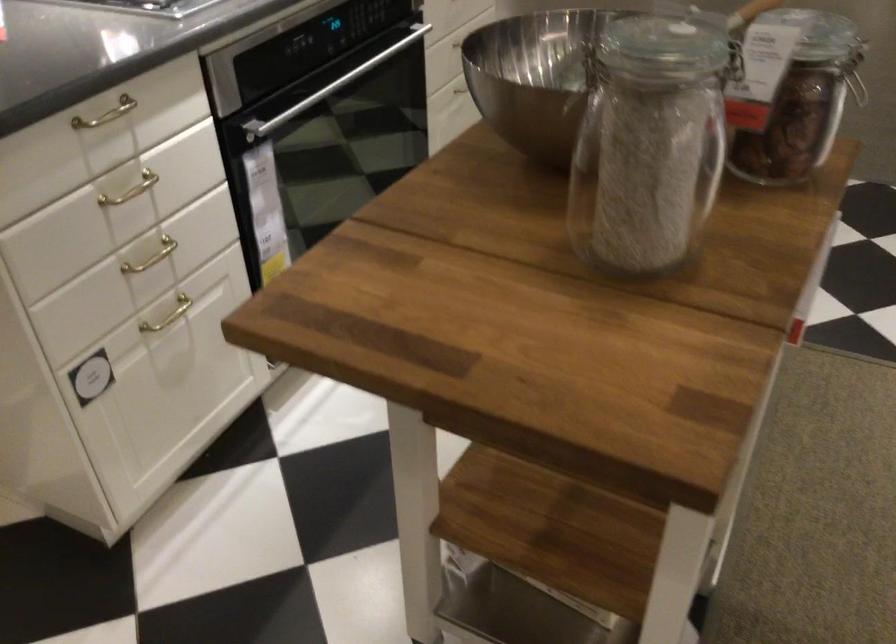
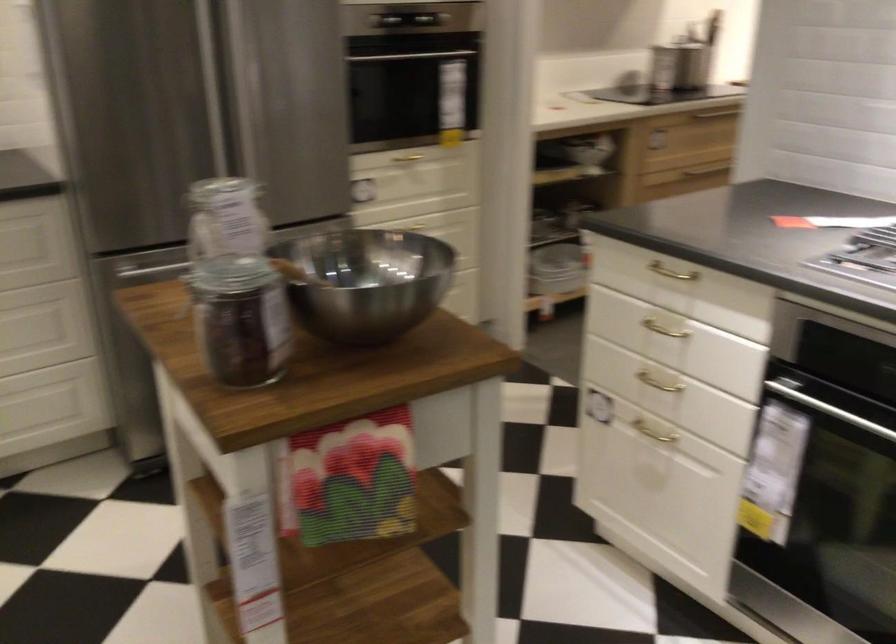
The point at (514, 122) is marked in the first image. Where is the corresponding point in the second image?

(366, 281)